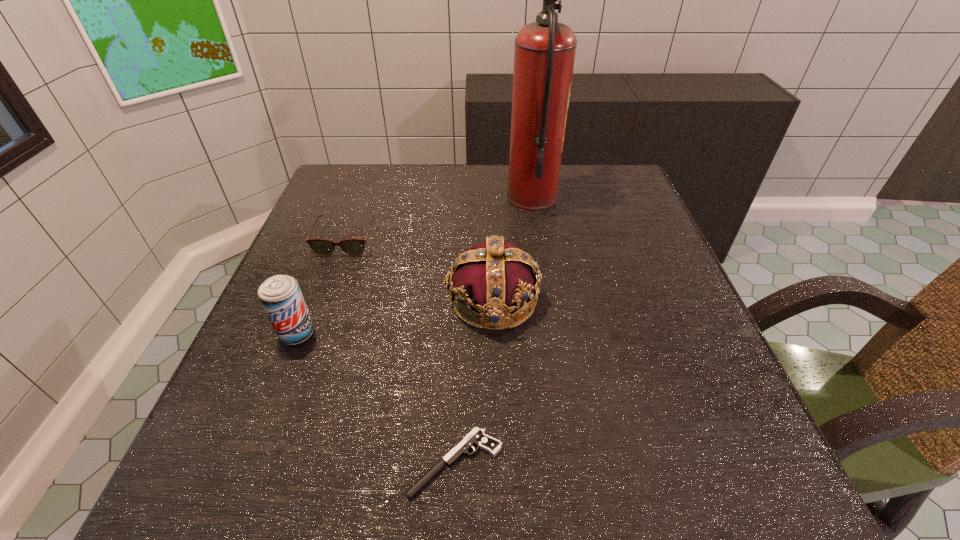
This screenshot has height=540, width=960. What are the coordinates of `spectacles that is at the left edge` in the screenshot? It's located at (354, 247).

You are a GUI agent. You are given a task and a screenshot of the screen. Output one action in this format:
    pyautogui.click(x=<x>, y=<y>)
    Task: Click on the vacant space at the far edge of the desktop
    
    Given the screenshot: What is the action you would take?
    pyautogui.click(x=467, y=204)

This screenshot has width=960, height=540. I want to click on free space at the near edge of the desktop, so click(307, 462).

Locate an element on the screen. This screenshot has height=540, width=960. free space at the left edge of the desktop is located at coordinates pos(253,428).

Where is `vacant area at the right edge`? This screenshot has width=960, height=540. vacant area at the right edge is located at coordinates (674, 351).

The height and width of the screenshot is (540, 960). I want to click on free space at the far left corner of the desktop, so click(361, 202).

Locate an element on the screen. This screenshot has height=540, width=960. free space at the far right corner is located at coordinates (608, 164).

Identify the location of vacant space at the near right corner of the desktop. The height and width of the screenshot is (540, 960). (698, 505).

This screenshot has width=960, height=540. In order to click on free spot between the shortest object and the third tallest object in this screenshot , I will do `click(376, 398)`.

The image size is (960, 540). Find the location of `free spot between the second farthest object and the third tallest object`. free spot between the second farthest object and the third tallest object is located at coordinates pos(322,287).